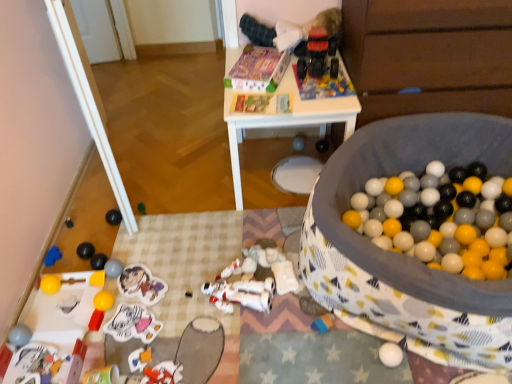
Where is `free point behind matte gray ball at lower left, which is counted as the tenth toy, starting from the left`? The height and width of the screenshot is (384, 512). free point behind matte gray ball at lower left, which is counted as the tenth toy, starting from the left is located at coordinates (131, 247).